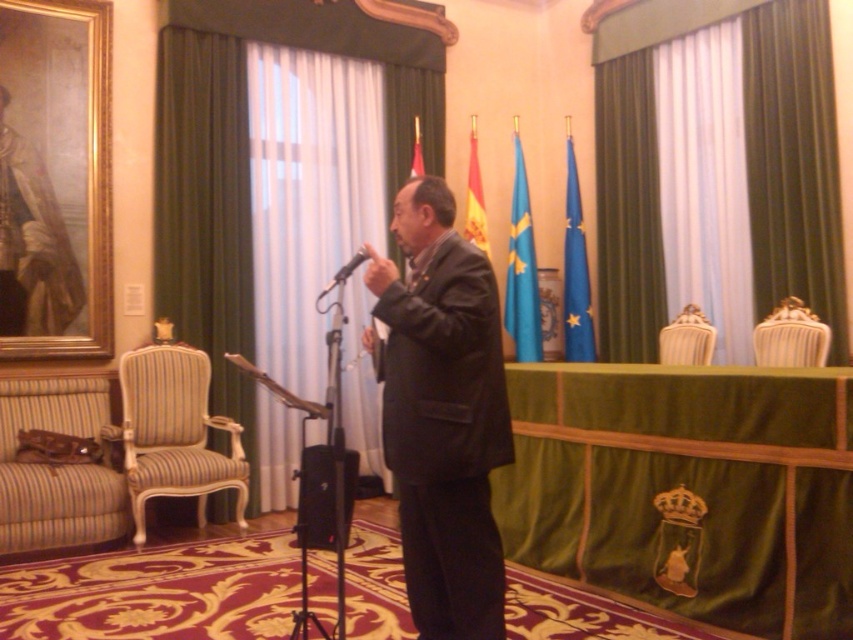
Does black matte suit at center appear over striped fabric armchair at lower left?

Yes.

Does black matte suit at center have a greater height compared to striped fabric armchair at lower left?

Yes, black matte suit at center is taller than striped fabric armchair at lower left.

Between point (402, 444) and point (78, 424), which one is positioned in front?

Point (402, 444)

Locate an element on the screen. The height and width of the screenshot is (640, 853). black matte suit at center is located at coordinates (442, 413).

Is black matte suit at center above striped fabric armchair at right?

No, black matte suit at center is not above striped fabric armchair at right.

Does black matte suit at center have a smaller size compared to striped fabric armchair at right?

Actually, black matte suit at center might be larger than striped fabric armchair at right.

Find the location of a particular element. This screenshot has width=853, height=640. black matte suit at center is located at coordinates (442, 413).

Identify the location of black matte suit at center. (442, 413).

Can you confirm if black matte suit at center is taller than blue fabric flag at upper center?

No.

Does point (466, 449) come closer to viewer compared to point (572, 259)?

Yes, point (466, 449) is closer to viewer.

Who is more forward, (430, 195) or (573, 332)?

Point (430, 195)

The width and height of the screenshot is (853, 640). In order to click on black matte suit at center in this screenshot , I will do `click(442, 413)`.